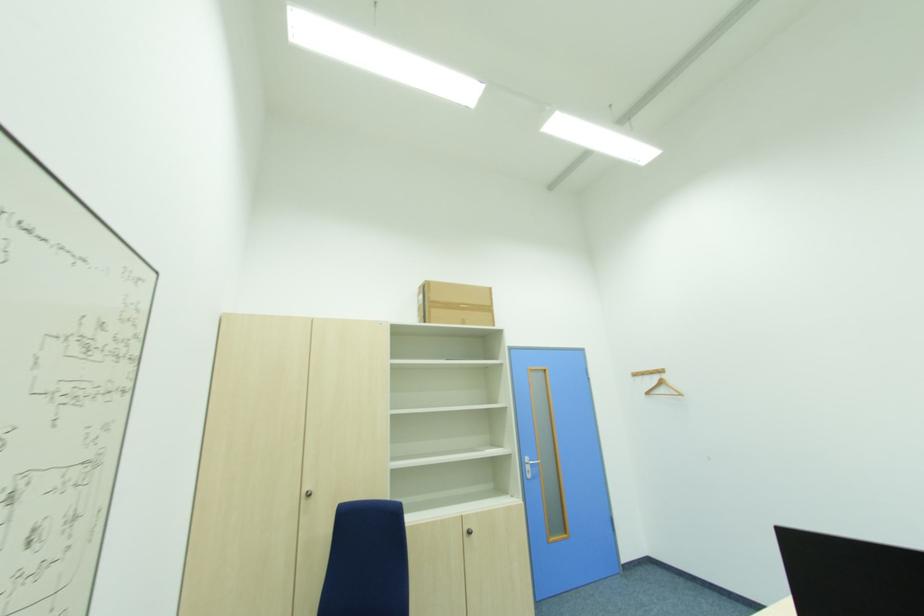
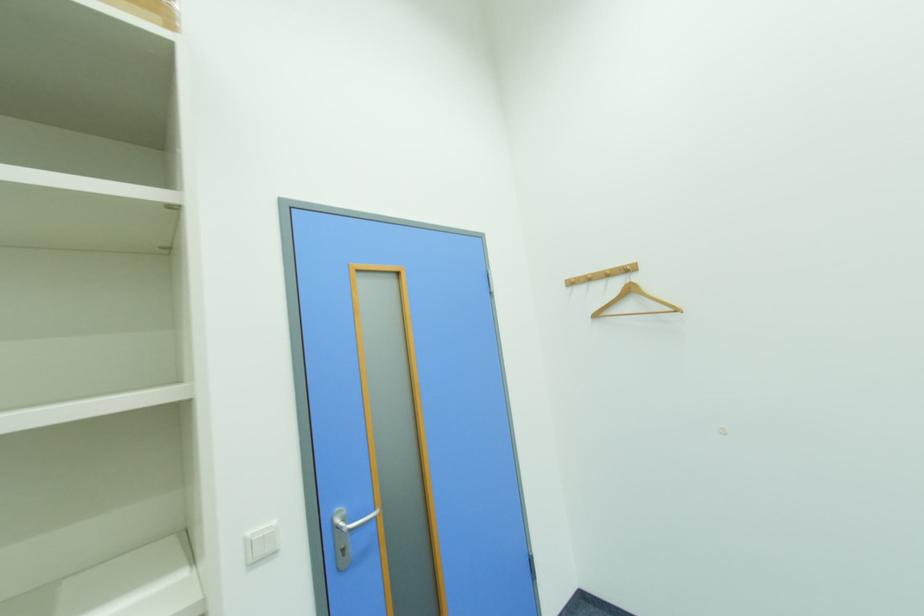
The point at (651, 394) is marked in the first image. Where is the corresponding point in the second image?

(601, 317)